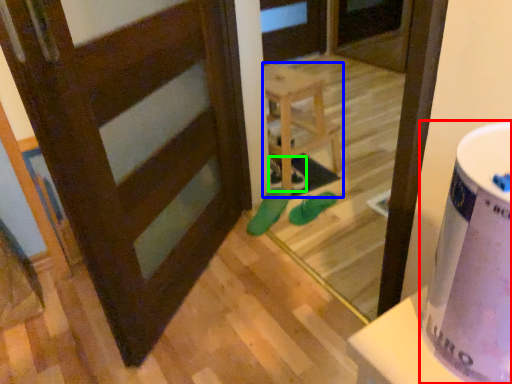
Question: Based on their relative distances, which object is nearer to potty (highlighted by a red box)? Choose from furniture (highlighted by a blue box) and shoe (highlighted by a green box).

Choices:
 (A) furniture
 (B) shoe

Answer: (A)